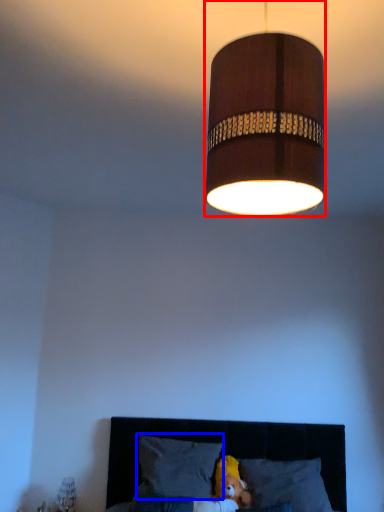
Question: Which of the following is the closest to the observer, lamp (highlighted by a red box) or pillow (highlighted by a blue box)?

Choices:
 (A) lamp
 (B) pillow

Answer: (A)